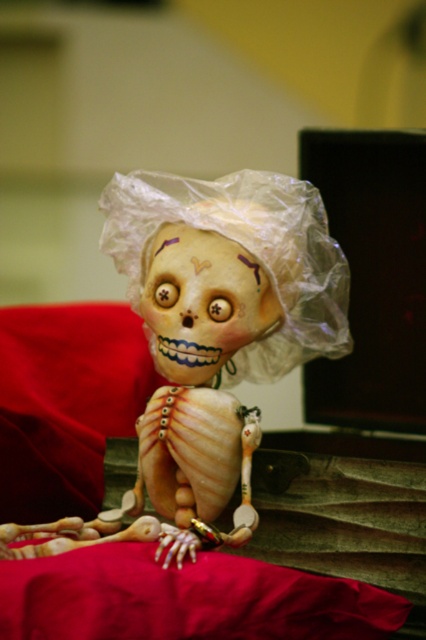
Question: Considering the relative positions of matte plastic zombie at center and transparent plastic doll at center in the image provided, where is matte plastic zombie at center located with respect to transparent plastic doll at center?

Choices:
 (A) above
 (B) below

Answer: (B)

Question: Which of the following is the farthest from the observer?

Choices:
 (A) (121, 241)
 (B) (195, 227)

Answer: (A)

Question: Which object is closer to the camera taking this photo?

Choices:
 (A) transparent plastic doll at center
 (B) matte plastic zombie at center

Answer: (B)

Question: Does matte plastic zombie at center appear over transparent plastic doll at center?

Choices:
 (A) no
 (B) yes

Answer: (A)

Question: Is matte plastic zombie at center bigger than transparent plastic doll at center?

Choices:
 (A) yes
 (B) no

Answer: (A)